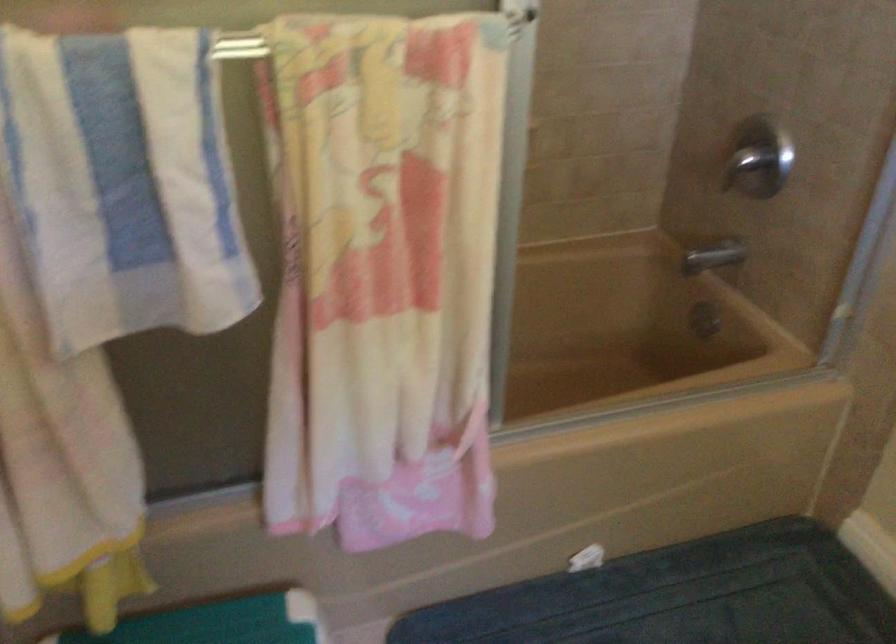
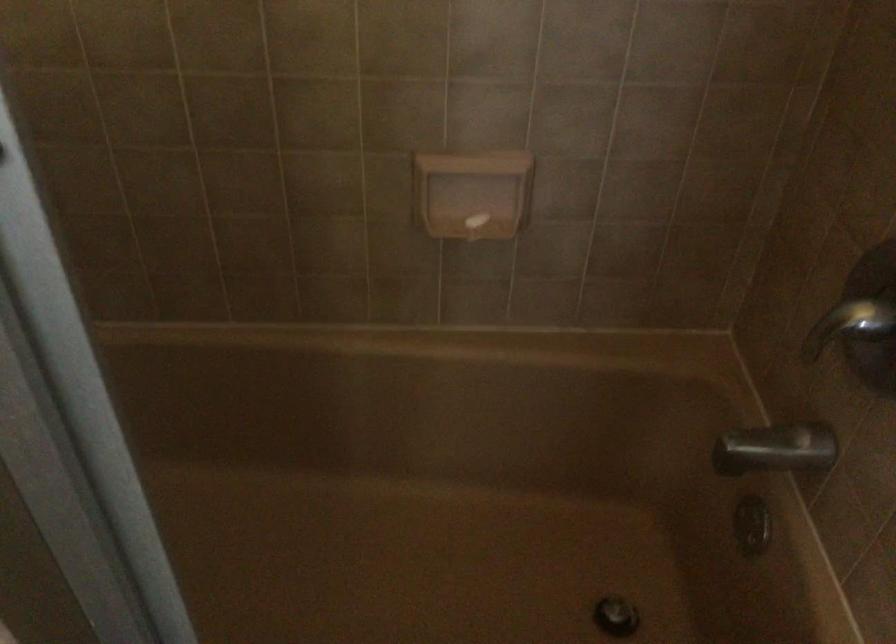
Find the pixel in the second image that matches point 713,254 in the first image.

(776, 449)